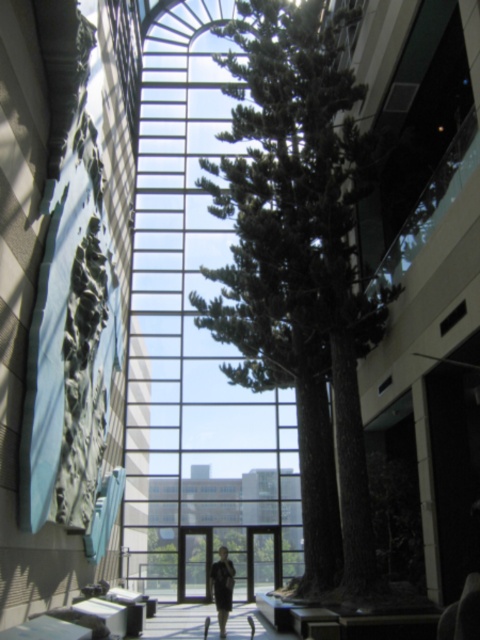
You are standing at the center of the modern building and looking around. There is a green textured tree at center. Where exactly is the green textured tree located in relation to the point marked at coordinates (x=300, y=266)?

The green textured tree at center is located exactly at the point marked by the coordinates (x=300, y=266).

You are standing in the atrium and want to take a photo of both the green textured tree at center and the dark gray suit at center. Since you can only focus on one object at a time, which one should you position closer to the camera to ensure both are in focus?

To ensure both the green textured tree at center and the dark gray suit at center are in focus, position the camera closer to the dark gray suit at center because the green textured tree at center is to the right of it, meaning it is farther away. This way, the depth of field will cover both objects more effectively.